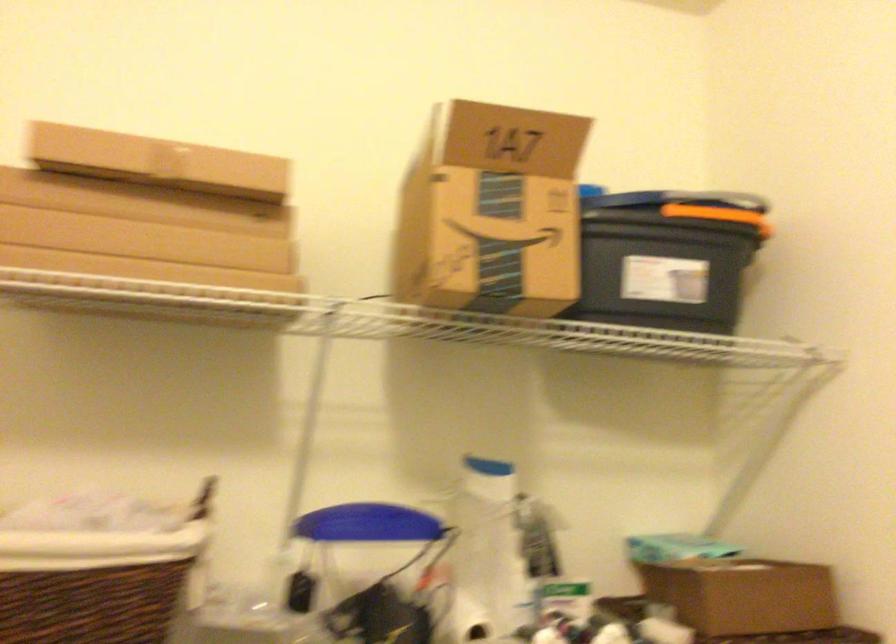
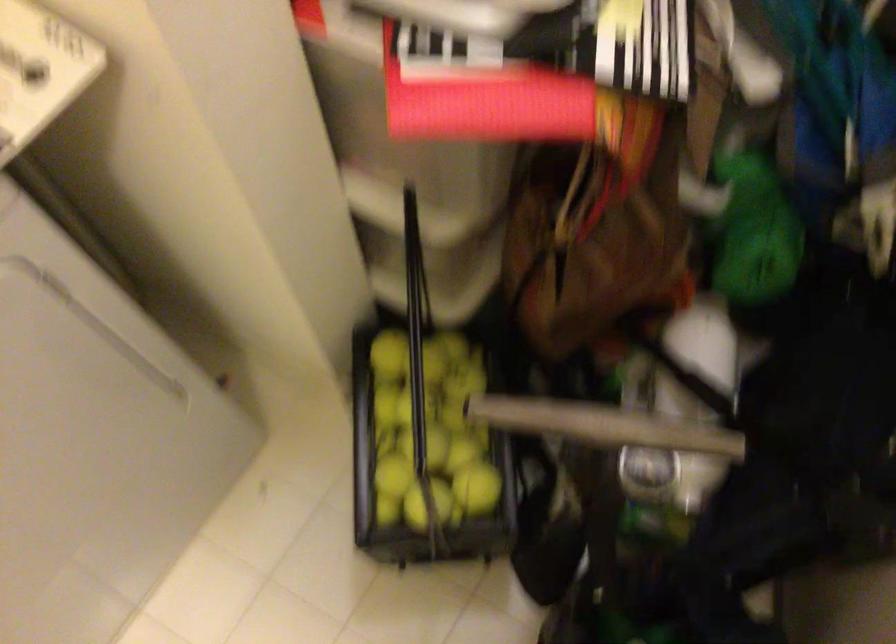
Consider the image. The images are taken continuously from a first-person perspective. In which direction is your viewpoint rotating?

The camera rotated toward right-down.